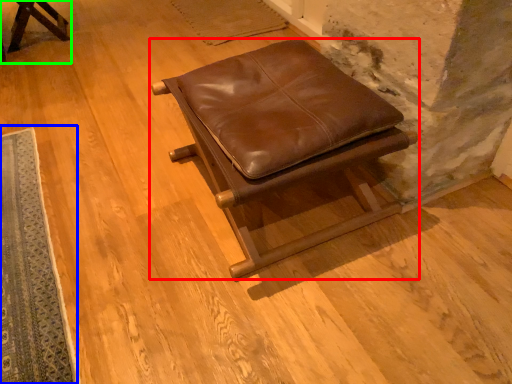
Question: Estimate the real-world distances between objects in this image. Which object is closer to furniture (highlighted by a red box), mat (highlighted by a blue box) or furniture (highlighted by a green box)?

Choices:
 (A) mat
 (B) furniture

Answer: (A)